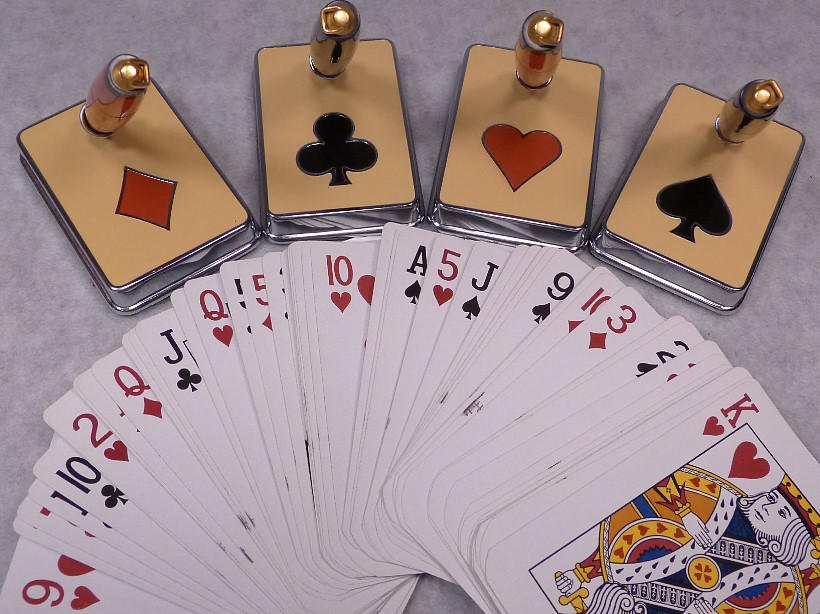
Where is `cards are tucked into these slots`? cards are tucked into these slots is located at coordinates (178, 277), (330, 220), (503, 228), (658, 270).